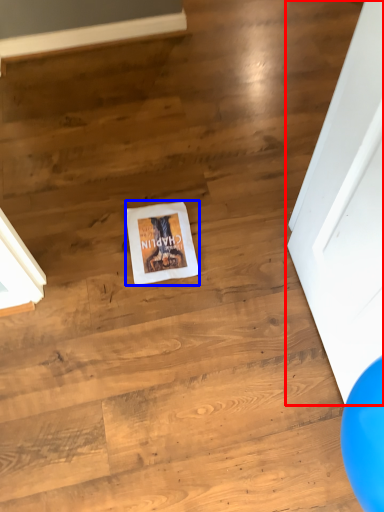
Question: Which point is further to the camera, door (highlighted by a red box) or flyer (highlighted by a blue box)?

Choices:
 (A) door
 (B) flyer

Answer: (B)